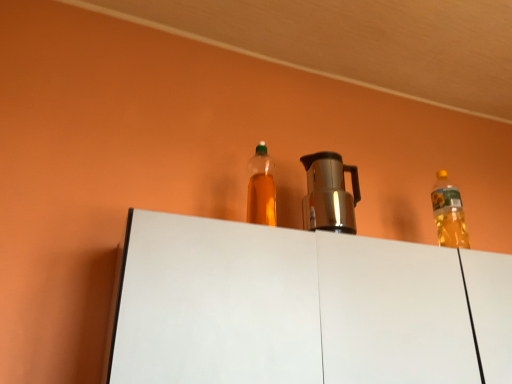
Question: Is satin silver coffee pot at center aimed at white matte cabinet at center?

Choices:
 (A) no
 (B) yes

Answer: (A)

Question: Can you confirm if satin silver coffee pot at center is bigger than white matte cabinet at center?

Choices:
 (A) yes
 (B) no

Answer: (B)

Question: Is satin silver coffee pot at center positioned before white matte cabinet at center?

Choices:
 (A) no
 (B) yes

Answer: (A)

Question: Is satin silver coffee pot at center located outside white matte cabinet at center?

Choices:
 (A) no
 (B) yes

Answer: (B)

Question: Is white matte cabinet at center located within satin silver coffee pot at center?

Choices:
 (A) yes
 (B) no

Answer: (B)

Question: Considering the positions of satin silver coffee pot at center and translucent plastic bottle at center in the image, is satin silver coffee pot at center wider or thinner than translucent plastic bottle at center?

Choices:
 (A) thin
 (B) wide

Answer: (B)

Question: From the image's perspective, is satin silver coffee pot at center positioned above or below translucent plastic bottle at center?

Choices:
 (A) below
 (B) above

Answer: (A)

Question: From a real-world perspective, relative to translucent plastic bottle at center, is satin silver coffee pot at center vertically above or below?

Choices:
 (A) above
 (B) below

Answer: (B)

Question: Is point (344, 211) closer or farther from the camera than point (274, 193)?

Choices:
 (A) closer
 (B) farther

Answer: (B)

Question: Would you say white matte cabinet at center is inside or outside satin silver coffee pot at center?

Choices:
 (A) inside
 (B) outside

Answer: (B)

Question: From a real-world perspective, is white matte cabinet at center physically located above or below satin silver coffee pot at center?

Choices:
 (A) above
 (B) below

Answer: (B)

Question: From the image's perspective, is white matte cabinet at center above or below satin silver coffee pot at center?

Choices:
 (A) below
 (B) above

Answer: (A)

Question: Considering the positions of white matte cabinet at center and satin silver coffee pot at center in the image, is white matte cabinet at center wider or thinner than satin silver coffee pot at center?

Choices:
 (A) wide
 (B) thin

Answer: (A)

Question: Is satin silver coffee pot at center taller or shorter than white matte cabinet at center?

Choices:
 (A) tall
 (B) short

Answer: (B)

Question: From a real-world perspective, is satin silver coffee pot at center above or below white matte cabinet at center?

Choices:
 (A) below
 (B) above

Answer: (B)